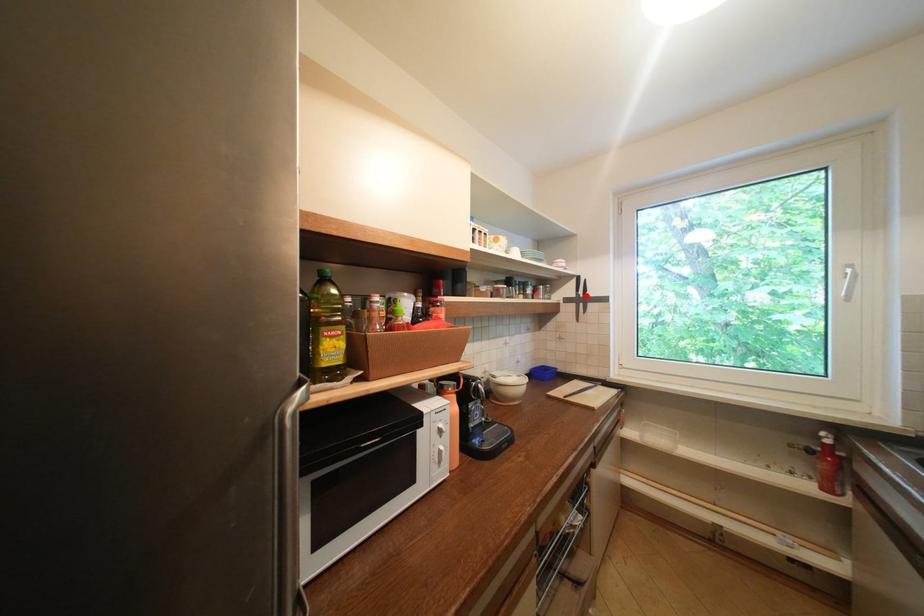
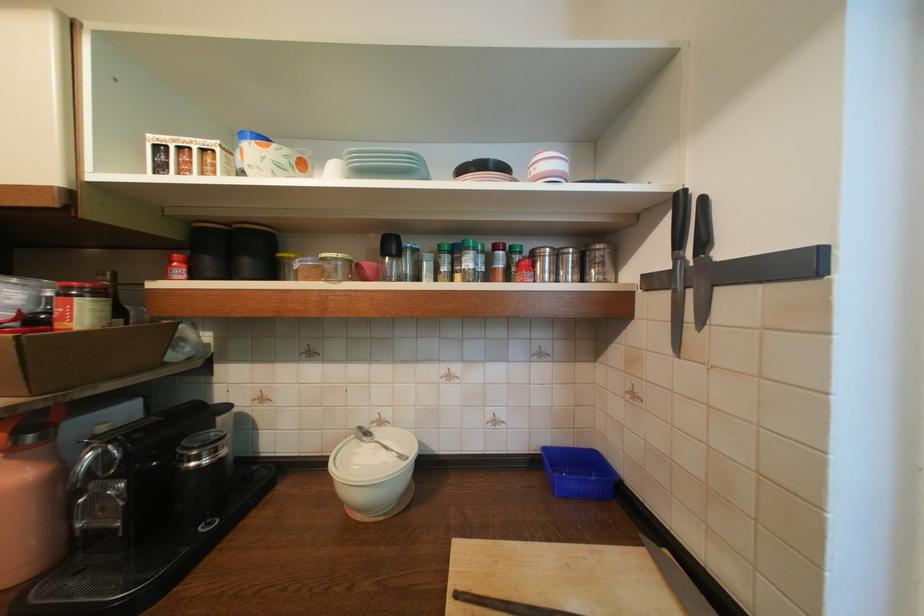
The point at the highlighted location is marked in the first image. Where is the corresponding point in the second image?

(686, 261)